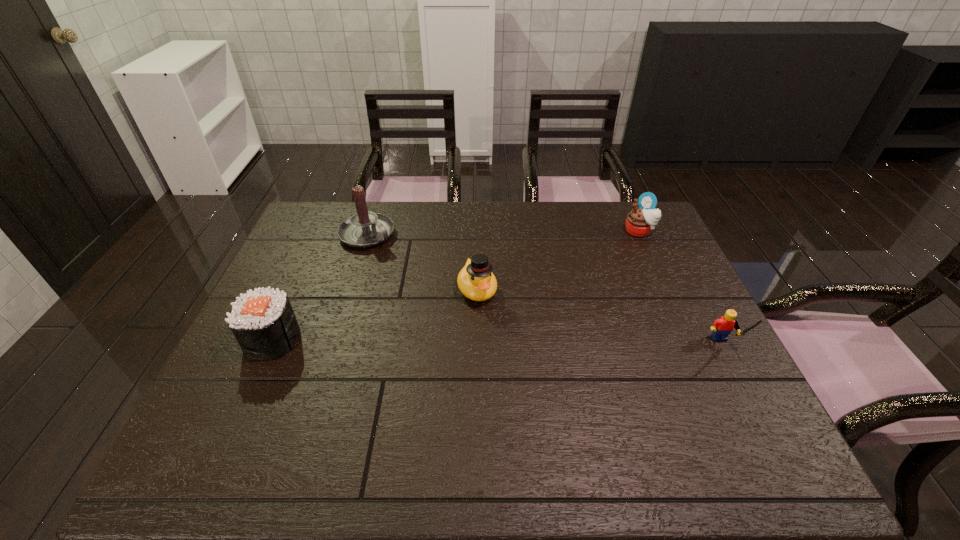
Identify the location of free space located 0.190m on the front-facing side of the muffin. (604, 266).

Identify the location of free spot located 0.130m on the front-facing side of the duck. point(499,343).

Image resolution: width=960 pixels, height=540 pixels. Find the location of `vacant position located 0.360m on the front-facing side of the duck`. vacant position located 0.360m on the front-facing side of the duck is located at coordinates (536, 422).

Locate an element on the screen. This screenshot has height=540, width=960. free space located 0.260m on the front-facing side of the duck is located at coordinates (518, 385).

You are a GUI agent. You are given a task and a screenshot of the screen. Output one action in this format:
    pyautogui.click(x=<x>, y=<y>)
    Task: Click on the blank area located 0.280m on the side of the tallest object with the handle loop
    
    Given the screenshot: What is the action you would take?
    pyautogui.click(x=443, y=289)

Where is `vacant space located on the side of the tallest object with the handle loop`? Image resolution: width=960 pixels, height=540 pixels. vacant space located on the side of the tallest object with the handle loop is located at coordinates (396, 255).

Find the location of `vacant space located 0.190m on the side of the tallest object with the handle loop`. vacant space located 0.190m on the side of the tallest object with the handle loop is located at coordinates (422, 274).

Find the location of a particular element. The width and height of the screenshot is (960, 540). muffin present at the far edge is located at coordinates (640, 221).

The image size is (960, 540). What are the coordinates of `candle present at the far edge` in the screenshot? It's located at (364, 229).

This screenshot has width=960, height=540. What are the coordinates of `sushi present at the left edge` in the screenshot? It's located at (263, 322).